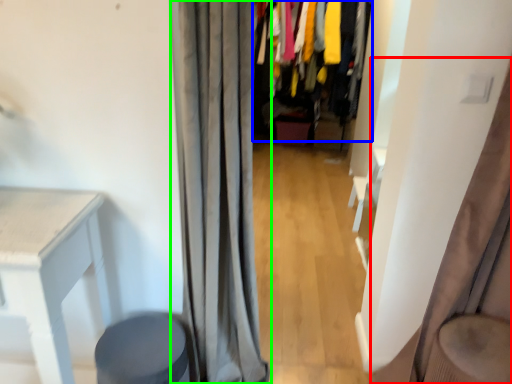
Question: Which object is the farthest from curtain (highlighted by a red box)? Choose among these: closet (highlighted by a blue box) or curtain (highlighted by a green box).

Choices:
 (A) closet
 (B) curtain

Answer: (A)